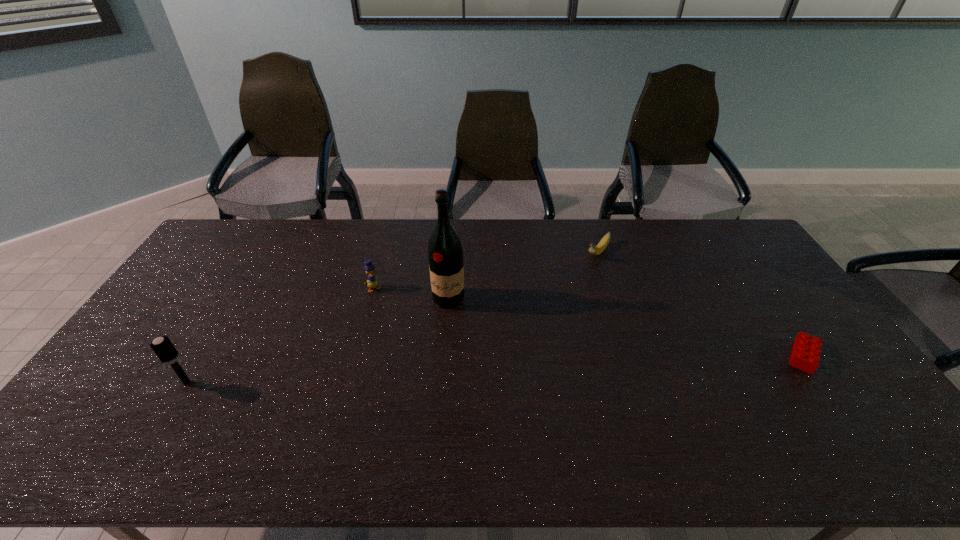
In order to click on blank space located 0.070m on the front of the hairbrush in this screenshot , I will do `click(169, 413)`.

Where is `free space located on the back of the rightmost object`? free space located on the back of the rightmost object is located at coordinates (756, 288).

Where is `vacant point located 0.080m on the face of the duckling, where the monocle is placed`? Image resolution: width=960 pixels, height=540 pixels. vacant point located 0.080m on the face of the duckling, where the monocle is placed is located at coordinates (386, 308).

At what (x,y) coordinates should I click in order to perform the action: click on vacant position located on the face of the duckling, where the monocle is placed. Please return your answer as a coordinate pair (x, y). Looking at the image, I should click on (399, 328).

Locate an element on the screen. The width and height of the screenshot is (960, 540). vacant space located on the face of the duckling, where the monocle is placed is located at coordinates (416, 355).

You are a GUI agent. You are given a task and a screenshot of the screen. Output one action in this format:
    pyautogui.click(x=<x>, y=<y>)
    Task: Click on the free space located on the front-facing side of the tallest object
    This screenshot has height=540, width=960.
    Given the screenshot: What is the action you would take?
    pyautogui.click(x=438, y=339)

Where is `free spot located on the front-facing side of the tallest object`? free spot located on the front-facing side of the tallest object is located at coordinates click(422, 399).

At what (x,y) coordinates should I click in order to perform the action: click on vacant area situated 0.260m on the front-facing side of the tallest object. Please return your answer as a coordinate pair (x, y). This screenshot has width=960, height=540. Looking at the image, I should click on (427, 379).

You are a GUI agent. You are given a task and a screenshot of the screen. Output one action in this format:
    pyautogui.click(x=<x>, y=<y>)
    Task: Click on the vacant space located 0.090m at the stem of the banana
    The width and height of the screenshot is (960, 540).
    Given the screenshot: What is the action you would take?
    (580, 276)

You are a GUI agent. You are given a task and a screenshot of the screen. Output one action in this format:
    pyautogui.click(x=<x>, y=<y>)
    Task: Click on the vacant space located at the stem of the banana
    This screenshot has height=540, width=960.
    Given the screenshot: What is the action you would take?
    pyautogui.click(x=554, y=304)